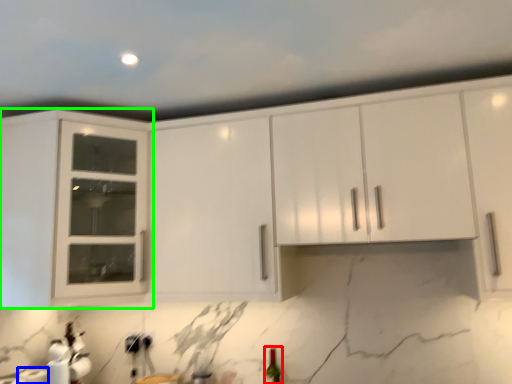
Question: Estimate the real-world distances between objects in this image. Which object is farther from wine bottle (highlighted by a red box), paper towel (highlighted by a blue box) or cabinetry (highlighted by a green box)?

Choices:
 (A) paper towel
 (B) cabinetry

Answer: (B)